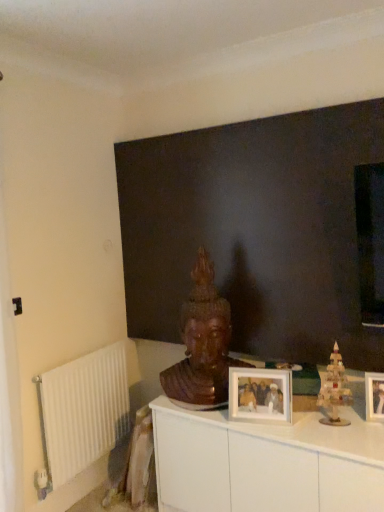
Question: From a real-world perspective, does wooden christmas tree at right sit lower than wooden picture frame at center, acting as the second picture frame starting from the left?

Choices:
 (A) no
 (B) yes

Answer: (A)

Question: Are wooden christmas tree at right and wooden picture frame at center, acting as the second picture frame starting from the left, located far from each other?

Choices:
 (A) no
 (B) yes

Answer: (A)

Question: Is wooden christmas tree at right to the left of wooden picture frame at center, the 1th picture frame viewed from the right, from the viewer's perspective?

Choices:
 (A) yes
 (B) no

Answer: (A)

Question: Is wooden christmas tree at right facing towards wooden picture frame at center, the 1th picture frame viewed from the right?

Choices:
 (A) yes
 (B) no

Answer: (B)

Question: Is wooden christmas tree at right thinner than wooden picture frame at center, the 1th picture frame viewed from the right?

Choices:
 (A) yes
 (B) no

Answer: (B)

Question: Relative to dark matte wall at center, is wooden picture frame at center, acting as the second picture frame starting from the left, in front or behind?

Choices:
 (A) behind
 (B) front

Answer: (A)

Question: Considering the positions of wooden picture frame at center, the 1th picture frame viewed from the right, and dark matte wall at center in the image, is wooden picture frame at center, the 1th picture frame viewed from the right, wider or thinner than dark matte wall at center?

Choices:
 (A) thin
 (B) wide

Answer: (A)

Question: Does point (377, 374) appear closer or farther from the camera than point (334, 182)?

Choices:
 (A) farther
 (B) closer

Answer: (B)

Question: From a real-world perspective, is wooden picture frame at center, the 1th picture frame viewed from the right, physically located above or below dark matte wall at center?

Choices:
 (A) below
 (B) above

Answer: (A)

Question: Considering the relative positions of white metallic radiator at left and white glossy cabinet at center in the image provided, is white metallic radiator at left to the left or to the right of white glossy cabinet at center?

Choices:
 (A) left
 (B) right

Answer: (A)

Question: Considering the positions of white metallic radiator at left and white glossy cabinet at center in the image, is white metallic radiator at left wider or thinner than white glossy cabinet at center?

Choices:
 (A) thin
 (B) wide

Answer: (A)

Question: From a real-world perspective, is white metallic radiator at left physically located above or below white glossy cabinet at center?

Choices:
 (A) below
 (B) above

Answer: (B)

Question: In terms of height, does white metallic radiator at left look taller or shorter compared to white glossy cabinet at center?

Choices:
 (A) tall
 (B) short

Answer: (A)

Question: From a real-world perspective, is wooden statue at center physically located above or below wooden picture frame at center, the 1th picture frame viewed from the right?

Choices:
 (A) above
 (B) below

Answer: (A)

Question: In terms of height, does wooden statue at center look taller or shorter compared to wooden picture frame at center, the 1th picture frame viewed from the right?

Choices:
 (A) short
 (B) tall

Answer: (B)